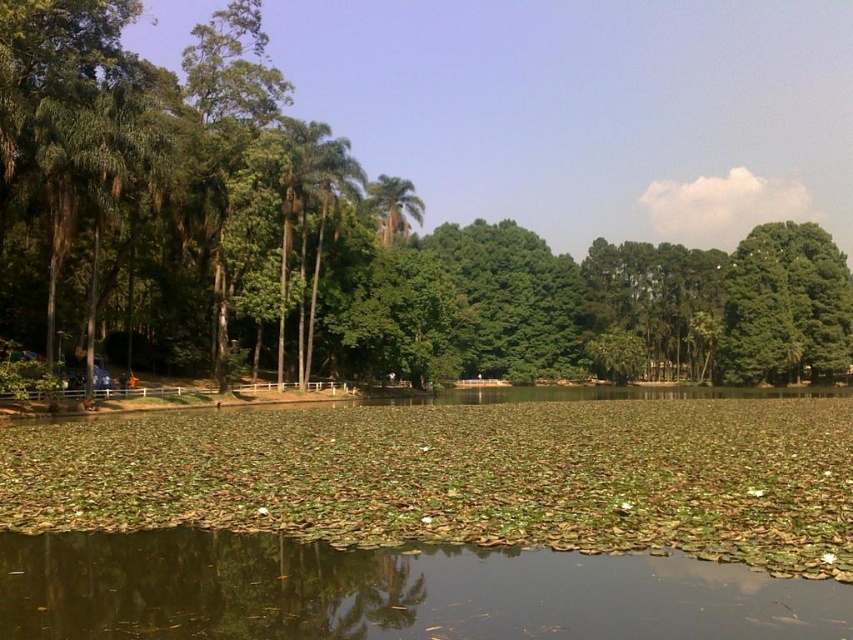
Based on the photo, you are a hiker standing on the paved path next to the water. You want to take a photo of both the green leafy tree at left and the green leafy palm tree at center. Which tree should you position closer to in order to capture both in the frame?

Since the green leafy tree at left is bigger than the green leafy palm tree at center, you should position closer to the green leafy palm tree at center to include both in the frame.

You are a landscape architect planning to add a bench between the green leafy tree at left and the green leafy palm tree at center. Which tree should the bench be closer to to ensure it is equidistant from both trees?

The bench should be closer to the green leafy palm tree at center because the green leafy tree at left is wider than the green leafy palm tree at center, so placing it closer to the narrower palm tree balances the distance.